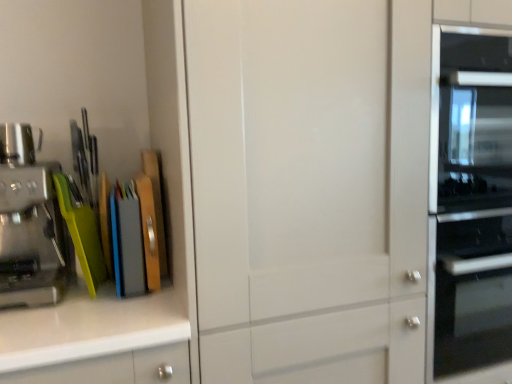
Question: Is point (418, 354) closer or farther from the camera than point (27, 276)?

Choices:
 (A) farther
 (B) closer

Answer: (A)

Question: From a real-world perspective, is transparent glass cabinet at center positioned above or below brushed metal coffee machine at left?

Choices:
 (A) below
 (B) above

Answer: (A)

Question: Estimate the real-world distances between objects in this image. Which object is closer to the transparent glass cabinet at center?

Choices:
 (A) brushed metal coffee maker at left
 (B) brushed metal coffee machine at left

Answer: (B)

Question: Based on their relative distances, which object is farther from the brushed metal coffee maker at left?

Choices:
 (A) brushed metal coffee machine at left
 (B) transparent glass cabinet at center

Answer: (B)